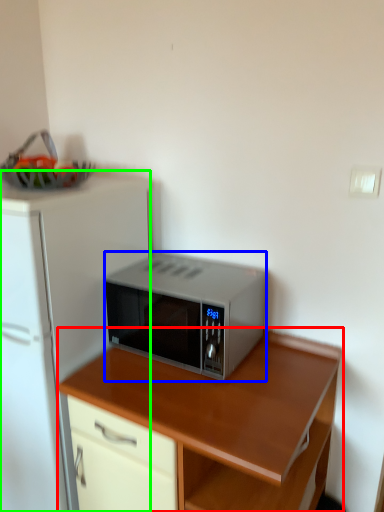
Question: Which is farther away from desk (highlighted by a red box)? microwave oven (highlighted by a blue box) or refrigerator (highlighted by a green box)?

Choices:
 (A) microwave oven
 (B) refrigerator

Answer: (B)